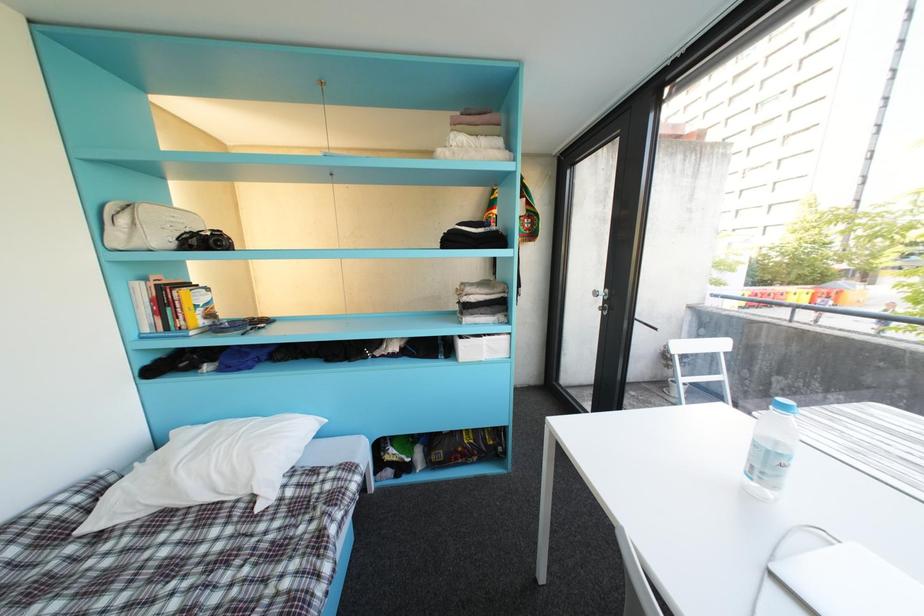
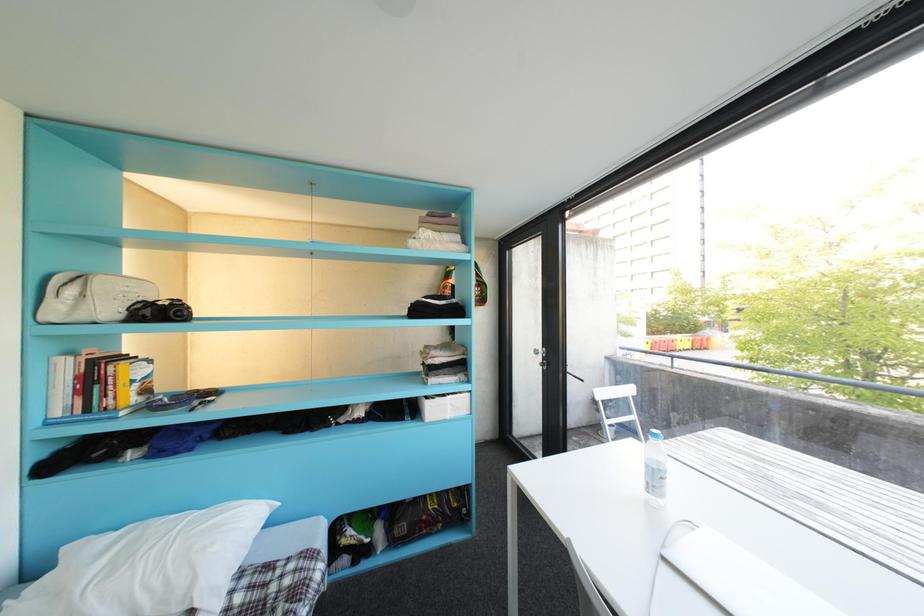
Question: The camera is either moving clockwise (left) or counter-clockwise (right) around the object. The first image is from the beginning of the video and the second image is from the end. Is the camera moving left or right when shooting the video?

Choices:
 (A) Left
 (B) Right

Answer: (A)